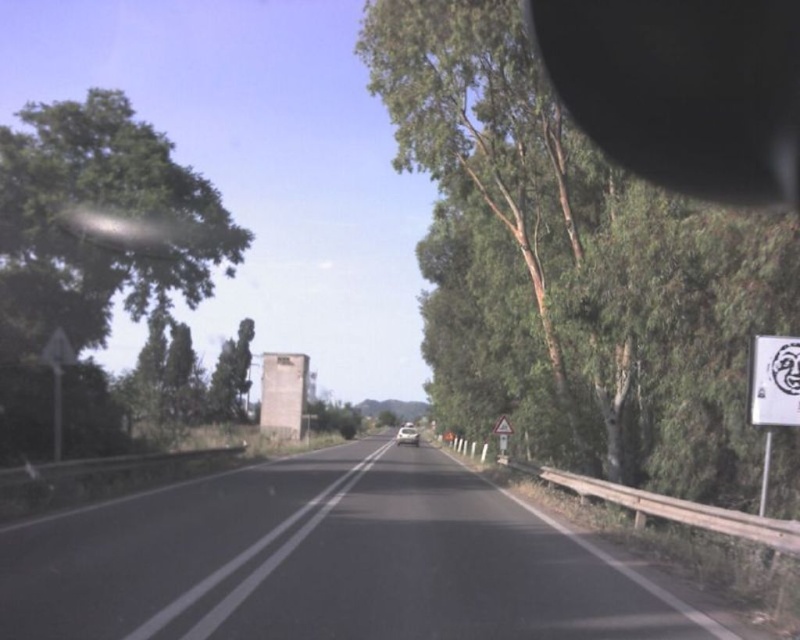
You are driving a car with a length of 4.5 meters. You want to overtake the vehicle ahead. The point at coordinates point (652,40) is 12.48 meters away from your car. Can you safely overtake the vehicle ahead before reaching that point?

The point at coordinates point (652,40) is 12.48 meters away from your car. To safely overtake, you need to ensure there is enough distance. Since the car is 4.5 meters long, and the distance to the point is 12.48 meters, which is more than double the car length, it is possible to overtake safely before reaching that point.

You are driving and need to focus on the road ahead. Considering the green leafy tree at right and the white plastic speed limit sign at right, which object takes up more space in your field of view?

The green leafy tree at right takes up more space in your field of view because its width is larger than the white plastic speed limit sign at right.

You are driving a car and want to check your blind spot using the black rubber view mirror at upper right. However, you need to ensure that the black asphalt road at center is still visible in your forward view. Given their distance apart, can you confirm if adjusting your mirror to see the blind spot might cause the road to go out of sight?

The black asphalt road at center and black rubber view mirror at upper right are 23.96 feet apart. Adjusting the mirror might not cause the road to go out of sight since the distance between them is significant enough to allow both the mirror adjustment and maintaining visibility of the road.